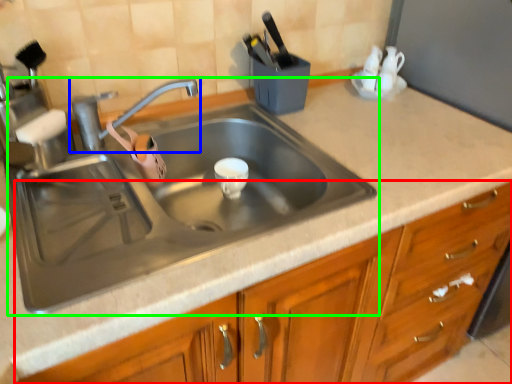
Question: Which is farther away from cabinetry (highlighted by a red box)? tap (highlighted by a blue box) or sink (highlighted by a green box)?

Choices:
 (A) tap
 (B) sink

Answer: (A)